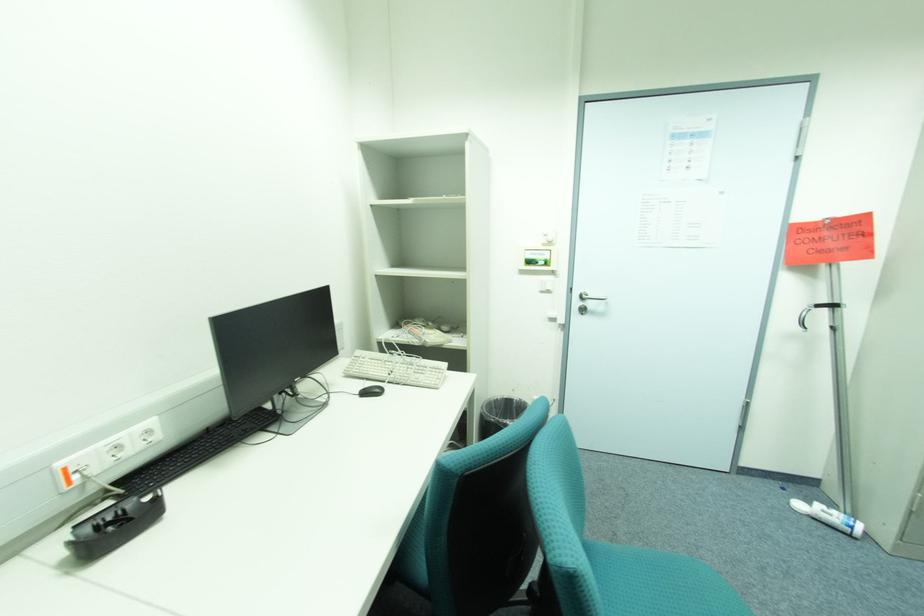
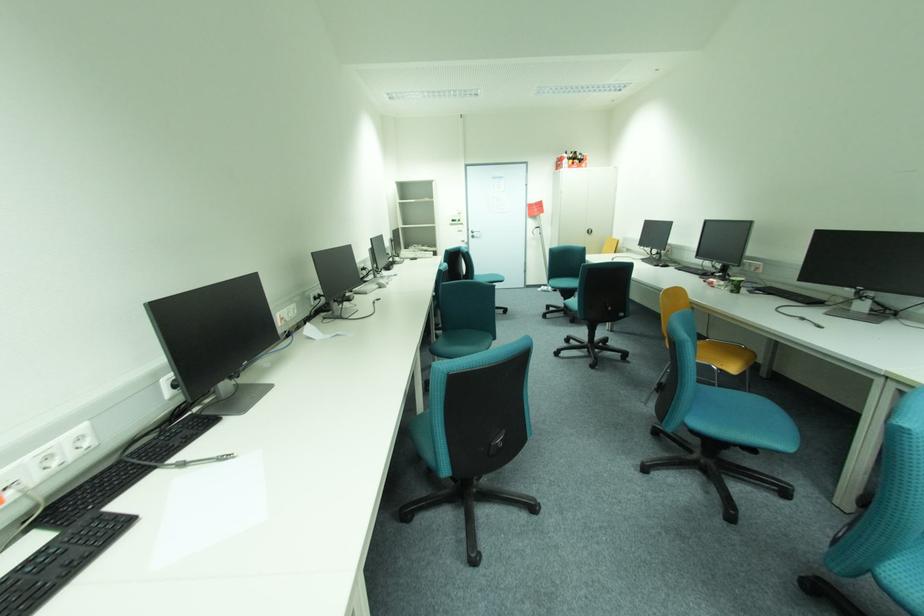
In the second image, find the point that corresponds to point (582, 304) in the first image.

(477, 235)